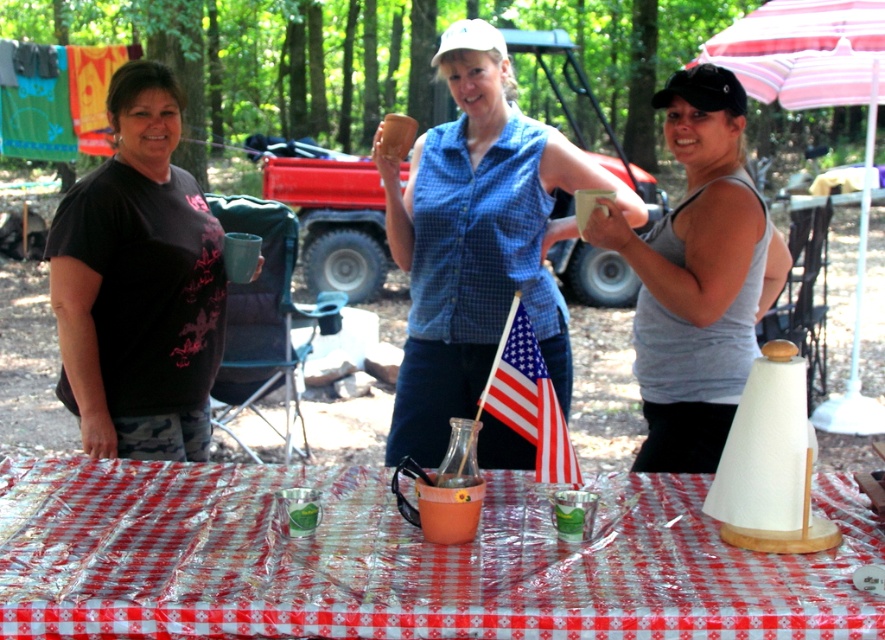
Is point (796, 99) farther from viewer compared to point (499, 413)?

Yes, it is behind point (499, 413).

Does pink striped fabric umbrella at upper right appear on the right side of american flag at center?

Indeed, pink striped fabric umbrella at upper right is positioned on the right side of american flag at center.

The image size is (885, 640). Describe the element at coordinates (817, 106) in the screenshot. I see `pink striped fabric umbrella at upper right` at that location.

Identify the location of pink striped fabric umbrella at upper right. (817, 106).

Describe the element at coordinates (137, 284) in the screenshot. I see `black matte t-shirt at left` at that location.

Does point (137, 140) lie in front of point (680, 250)?

No, it is behind (680, 250).

Between point (112, 100) and point (767, 305), which one is positioned in front?

Point (112, 100) is more forward.

This screenshot has width=885, height=640. Identify the location of black matte t-shirt at left. (137, 284).

Is point (660, 298) farther from viewer compared to point (517, 422)?

That is True.

Between point (664, 298) and point (499, 380), which one is positioned in front?

Point (499, 380) is in front.

Is point (722, 113) positioned in front of point (545, 413)?

No.

Where is `gray tank top at right`? This screenshot has width=885, height=640. gray tank top at right is located at coordinates (697, 276).